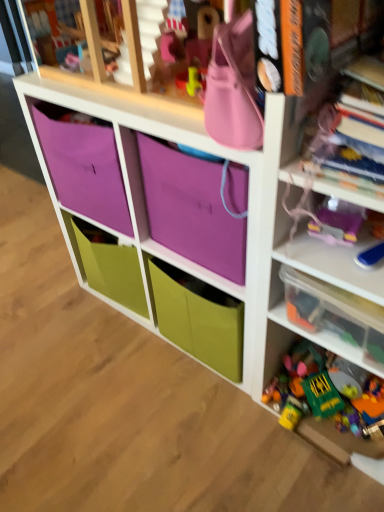
Question: Is point (352, 310) closer or farther from the camera than point (210, 266)?

Choices:
 (A) farther
 (B) closer

Answer: (B)

Question: From a real-world perspective, is clear plastic container at right positioned above or below purple fabric bag at upper center?

Choices:
 (A) above
 (B) below

Answer: (B)

Question: Considering the real-world distances, which object is farthest from the purple fabric storage at center?

Choices:
 (A) clear plastic container at right
 (B) translucent plastic toys at right
 (C) purple fabric bag at upper center
 (D) plastic colorful toys at lower right

Answer: (D)

Question: Which object is the closest to the plastic colorful toys at lower right?

Choices:
 (A) translucent plastic toys at right
 (B) purple fabric bag at upper center
 (C) purple fabric storage at center
 (D) clear plastic container at right

Answer: (A)